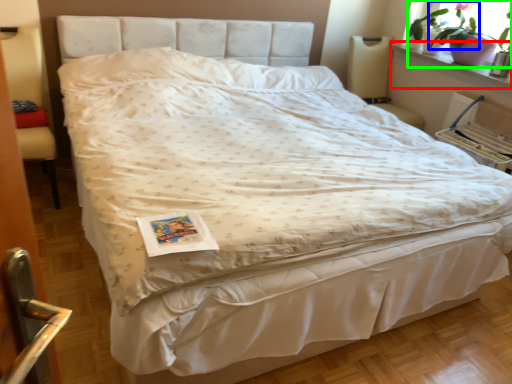
Question: Which object is positioned farthest from window sill (highlighted by a red box)? Select from plant (highlighted by a blue box) and houseplant (highlighted by a green box).

Choices:
 (A) plant
 (B) houseplant

Answer: (A)